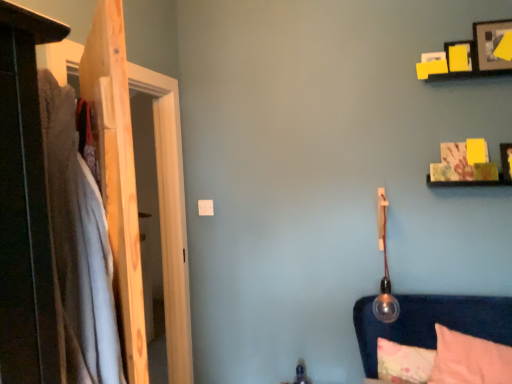
Question: Is wooden door at left turned away from wooden picture frame at upper right, the 1th picture frame when ordered from top to bottom?

Choices:
 (A) no
 (B) yes

Answer: (A)

Question: Can we say wooden door at left lies outside wooden picture frame at upper right, the third picture frame ordered from the bottom?

Choices:
 (A) yes
 (B) no

Answer: (A)

Question: Can you confirm if wooden door at left is taller than wooden picture frame at upper right, the third picture frame ordered from the bottom?

Choices:
 (A) no
 (B) yes

Answer: (B)

Question: Considering the relative sizes of wooden door at left and wooden picture frame at upper right, the 1th picture frame when ordered from top to bottom, in the image provided, is wooden door at left bigger than wooden picture frame at upper right, the 1th picture frame when ordered from top to bottom,?

Choices:
 (A) no
 (B) yes

Answer: (B)

Question: Can you confirm if wooden door at left is smaller than wooden picture frame at upper right, the third picture frame ordered from the bottom?

Choices:
 (A) yes
 (B) no

Answer: (B)

Question: Considering the relative positions of fluffy pink pillow at lower right, which is the second pillow in front-to-back order, and soft cotton blanket at left in the image provided, is fluffy pink pillow at lower right, which is the second pillow in front-to-back order, to the left or to the right of soft cotton blanket at left?

Choices:
 (A) left
 (B) right

Answer: (B)

Question: From a real-world perspective, is fluffy pink pillow at lower right, which is counted as the first pillow, starting from the back, positioned above or below soft cotton blanket at left?

Choices:
 (A) below
 (B) above

Answer: (A)

Question: Is fluffy pink pillow at lower right, which is the second pillow in front-to-back order, spatially inside soft cotton blanket at left, or outside of it?

Choices:
 (A) inside
 (B) outside

Answer: (B)

Question: Relative to soft cotton blanket at left, is fluffy pink pillow at lower right, which is the second pillow in front-to-back order, in front or behind?

Choices:
 (A) front
 (B) behind

Answer: (B)

Question: In terms of width, does fluffy pink pillow at lower right, which is the second pillow in front-to-back order, look wider or thinner when compared to wooden picture frame at upper right, which is the 1th picture frame from bottom to top?

Choices:
 (A) wide
 (B) thin

Answer: (A)

Question: From the image's perspective, relative to wooden picture frame at upper right, the 3th picture frame positioned from the top, is fluffy pink pillow at lower right, which is the second pillow in front-to-back order, above or below?

Choices:
 (A) above
 (B) below

Answer: (B)

Question: From a real-world perspective, relative to wooden picture frame at upper right, the 3th picture frame positioned from the top, is fluffy pink pillow at lower right, which is counted as the first pillow, starting from the back, vertically above or below?

Choices:
 (A) below
 (B) above

Answer: (A)

Question: Considering their positions, is fluffy pink pillow at lower right, which is counted as the first pillow, starting from the back, located in front of or behind wooden picture frame at upper right, which is the 1th picture frame from bottom to top?

Choices:
 (A) front
 (B) behind

Answer: (A)

Question: Relative to wooden picture frame at upper right, which is the 1th picture frame from bottom to top, is soft cotton blanket at left in front or behind?

Choices:
 (A) front
 (B) behind

Answer: (A)

Question: Is soft cotton blanket at left bigger or smaller than wooden picture frame at upper right, the 3th picture frame positioned from the top?

Choices:
 (A) big
 (B) small

Answer: (A)